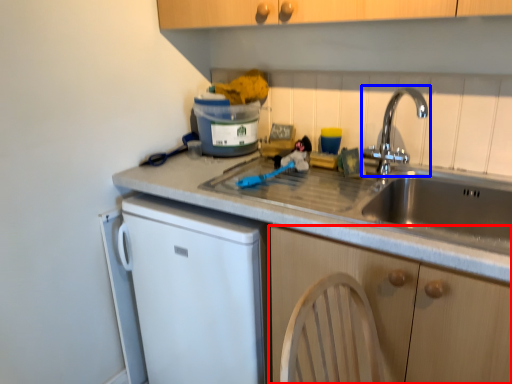
Question: Which object is further to the camera taking this photo, cabinetry (highlighted by a red box) or tap (highlighted by a blue box)?

Choices:
 (A) cabinetry
 (B) tap

Answer: (B)